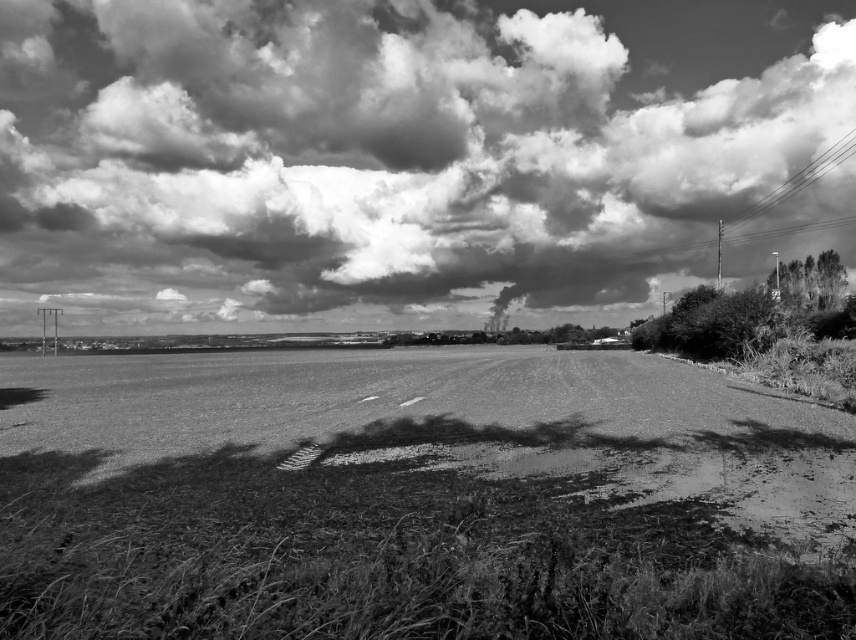
Question: Can you confirm if dirt/gritty at center is positioned below smooth wire at upper right?

Choices:
 (A) yes
 (B) no

Answer: (A)

Question: Does cloudy sky at upper center appear over dirt/gritty at center?

Choices:
 (A) no
 (B) yes

Answer: (B)

Question: Which object appears farthest from the camera in this image?

Choices:
 (A) smooth wire at upper right
 (B) cloudy sky at upper center

Answer: (A)

Question: Which object is the farthest from the cloudy sky at upper center?

Choices:
 (A) dirt/gritty at center
 (B) smooth wire at upper right

Answer: (A)

Question: Considering the relative positions of cloudy sky at upper center and dirt/gritty at center in the image provided, where is cloudy sky at upper center located with respect to dirt/gritty at center?

Choices:
 (A) left
 (B) right

Answer: (A)

Question: Which of the following is the closest to the observer?

Choices:
 (A) (372, 305)
 (B) (654, 388)
 (C) (813, 172)

Answer: (B)